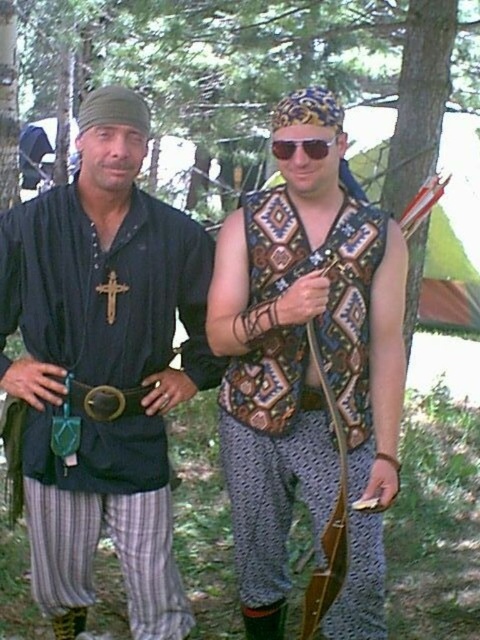
Is matte black shirt at center further to the viewer compared to patterned fabric vest at center?

No, matte black shirt at center is in front of patterned fabric vest at center.

Which of these two, matte black shirt at center or patterned fabric vest at center, stands taller?

matte black shirt at center

Measure the distance between matte black shirt at center and camera.

A distance of 6.78 feet exists between matte black shirt at center and camera.

Locate an element on the screen. matte black shirt at center is located at coordinates (101, 369).

Does patterned fabric vest at center have a greater width compared to brown leather belt at center?

Correct, the width of patterned fabric vest at center exceeds that of brown leather belt at center.

Who is positioned more to the left, patterned fabric vest at center or brown leather belt at center?

brown leather belt at center is more to the left.

The image size is (480, 640). In order to click on patterned fabric vest at center in this screenshot , I will do `click(274, 458)`.

Is matte black shirt at center taller than sunglasses at center?

Indeed, matte black shirt at center has a greater height compared to sunglasses at center.

Does matte black shirt at center appear on the right side of sunglasses at center?

In fact, matte black shirt at center is to the left of sunglasses at center.

Which is in front, point (206, 376) or point (322, 145)?

Point (322, 145)

Find the location of a particular element. The height and width of the screenshot is (640, 480). matte black shirt at center is located at coordinates (101, 369).